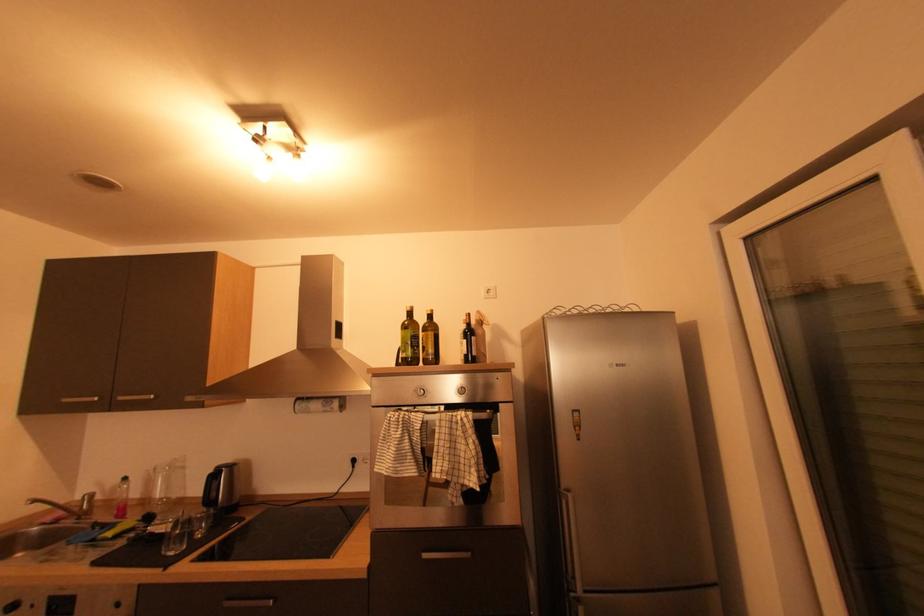
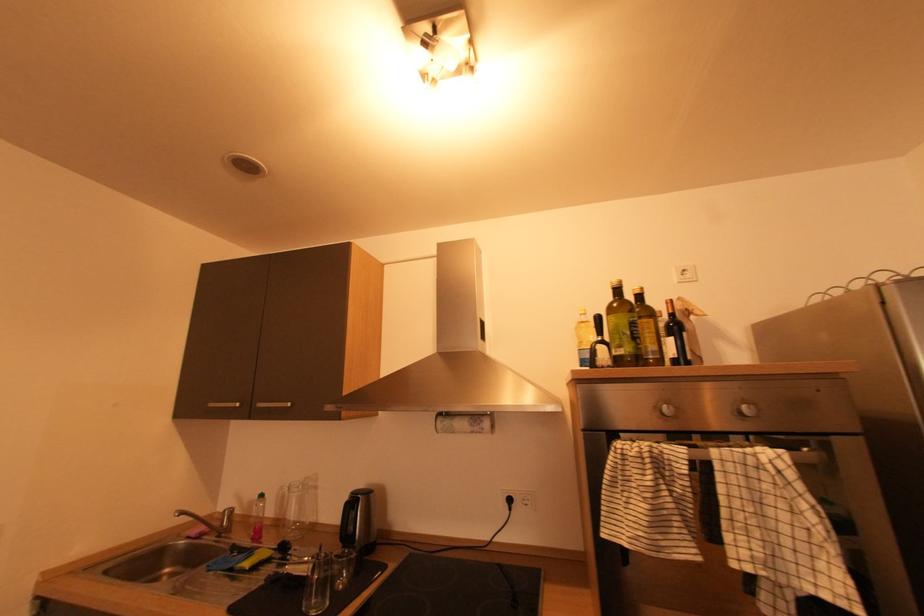
Question: The camera is either moving clockwise (left) or counter-clockwise (right) around the object. The first image is from the beginning of the video and the second image is from the end. Is the camera moving left or right when shooting the video?

Choices:
 (A) Left
 (B) Right

Answer: (B)